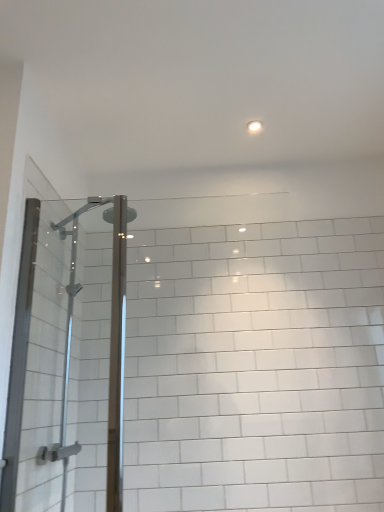
The width and height of the screenshot is (384, 512). What do you see at coordinates (67, 362) in the screenshot? I see `clear glass shower door at left` at bounding box center [67, 362].

Find the location of `clear glass shower door at left`. clear glass shower door at left is located at coordinates (67, 362).

Image resolution: width=384 pixels, height=512 pixels. I want to click on white glossy light fixture at upper center, so click(254, 127).

The width and height of the screenshot is (384, 512). Describe the element at coordinates (254, 127) in the screenshot. I see `white glossy light fixture at upper center` at that location.

What are the coordinates of `clear glass shower door at left` in the screenshot? It's located at (67, 362).

Considering the positions of objects clear glass shower door at left and white glossy light fixture at upper center in the image provided, who is more to the right, clear glass shower door at left or white glossy light fixture at upper center?

Positioned to the right is white glossy light fixture at upper center.

Which object is further away from the camera, clear glass shower door at left or white glossy light fixture at upper center?

white glossy light fixture at upper center is more distant.

Which is less distant, (x=43, y=398) or (x=253, y=132)?

The point (x=43, y=398) is closer.

From the image's perspective, which one is positioned higher, clear glass shower door at left or white glossy light fixture at upper center?

white glossy light fixture at upper center.

From a real-world perspective, between clear glass shower door at left and white glossy light fixture at upper center, who is vertically lower?

clear glass shower door at left.

Looking at their sizes, would you say clear glass shower door at left is wider or thinner than white glossy light fixture at upper center?

Clearly, clear glass shower door at left has more width compared to white glossy light fixture at upper center.

Considering the sizes of clear glass shower door at left and white glossy light fixture at upper center in the image, is clear glass shower door at left taller or shorter than white glossy light fixture at upper center?

In the image, clear glass shower door at left appears to be taller than white glossy light fixture at upper center.

Between clear glass shower door at left and white glossy light fixture at upper center, which one has smaller size?

white glossy light fixture at upper center.

Is white glossy light fixture at upper center completely or partially inside clear glass shower door at left?

Definitely not — white glossy light fixture at upper center is not inside clear glass shower door at left.

Is clear glass shower door at left beside white glossy light fixture at upper center?

No.

Looking at this image, is clear glass shower door at left positioned with its back to white glossy light fixture at upper center?

clear glass shower door at left is not turned away from white glossy light fixture at upper center.

How many degrees apart are the facing directions of clear glass shower door at left and white glossy light fixture at upper center?

clear glass shower door at left and white glossy light fixture at upper center are facing 5.99 degrees away from each other.

You are a GUI agent. You are given a task and a screenshot of the screen. Output one action in this format:
    pyautogui.click(x=<x>, y=<y>)
    Task: Click on the light fixture above the clear glass shower door at left (from a real-world perspective)
    
    Given the screenshot: What is the action you would take?
    pyautogui.click(x=254, y=127)

Is white glossy light fixture at upper center to the right of clear glass shower door at left from the viewer's perspective?

Yes, white glossy light fixture at upper center is to the right of clear glass shower door at left.

Is white glossy light fixture at upper center in front of clear glass shower door at left?

No, it is behind clear glass shower door at left.

Consider the image. Which point is more distant from viewer, (251,131) or (135,217)?

The point (135,217) is behind.

From the image's perspective, between white glossy light fixture at upper center and clear glass shower door at left, who is located below?

clear glass shower door at left, from the image's perspective.

From a real-world perspective, which object stands above the other?

From a 3D spatial view, white glossy light fixture at upper center is above.

Can you confirm if white glossy light fixture at upper center is wider than clear glass shower door at left?

Incorrect, the width of white glossy light fixture at upper center does not surpass that of clear glass shower door at left.

Consider the image. Can you confirm if white glossy light fixture at upper center is shorter than clear glass shower door at left?

Correct, white glossy light fixture at upper center is not as tall as clear glass shower door at left.

Based on their sizes in the image, would you say white glossy light fixture at upper center is bigger or smaller than clear glass shower door at left?

Clearly, white glossy light fixture at upper center is smaller in size than clear glass shower door at left.

Would you say white glossy light fixture at upper center contains clear glass shower door at left?

No, clear glass shower door at left is not inside white glossy light fixture at upper center.

Is white glossy light fixture at upper center not near clear glass shower door at left?

Absolutely, white glossy light fixture at upper center is distant from clear glass shower door at left.

Looking at this image, is white glossy light fixture at upper center facing away from clear glass shower door at left?

No, white glossy light fixture at upper center is not facing away from clear glass shower door at left.

Looking at this image, can you tell me how much white glossy light fixture at upper center and clear glass shower door at left differ in facing direction?

5.99 degrees.

Measure the distance between white glossy light fixture at upper center and clear glass shower door at left.

white glossy light fixture at upper center is 4.63 feet from clear glass shower door at left.

Identify the location of light fixture positioned vertically above the clear glass shower door at left (from a real-world perspective). The image size is (384, 512). (254, 127).

At what (x,y) coordinates should I click in order to perform the action: click on screen door below the white glossy light fixture at upper center (from a real-world perspective). Please return your answer as a coordinate pair (x, y). Looking at the image, I should click on (67, 362).

Locate an element on the screen. This screenshot has height=512, width=384. light fixture above the clear glass shower door at left (from the image's perspective) is located at coordinates (254, 127).